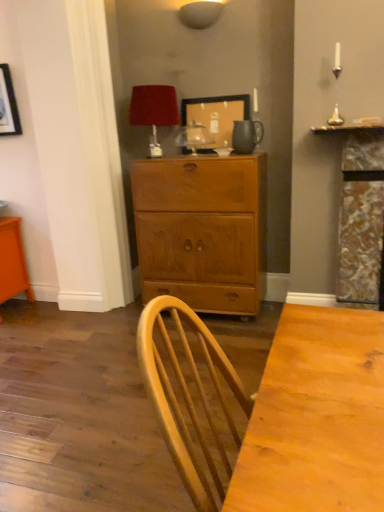
Question: From the image's perspective, relative to wooden picture frame at upper center, is velvet red lampshade at upper center, which appears as the 1th lamp when viewed from the left, above or below?

Choices:
 (A) below
 (B) above

Answer: (B)

Question: Considering the positions of velvet red lampshade at upper center, the second lamp in the top-to-bottom sequence, and wooden picture frame at upper center in the image, is velvet red lampshade at upper center, the second lamp in the top-to-bottom sequence, taller or shorter than wooden picture frame at upper center?

Choices:
 (A) tall
 (B) short

Answer: (A)

Question: Which of these objects is positioned farthest from the wooden cabinet at center?

Choices:
 (A) orange glossy vanity at lower left
 (B) wooden picture frame at upper center
 (C) velvet red lampshade at upper center, which appears as the 1th lamp when viewed from the left
 (D) matte white lampshade at upper center, which appears as the second lamp when ordered from the bottom
 (E) matte brown pitcher at upper center

Answer: (D)

Question: Estimate the real-world distances between objects in this image. Which object is closer to the orange glossy vanity at lower left?

Choices:
 (A) wooden cabinet at center
 (B) matte brown pitcher at upper center
 (C) wooden picture frame at upper center
 (D) velvet red lampshade at upper center, which appears as the 1th lamp when viewed from the left
 (E) matte white lampshade at upper center, the 1th lamp when ordered from right to left

Answer: (A)